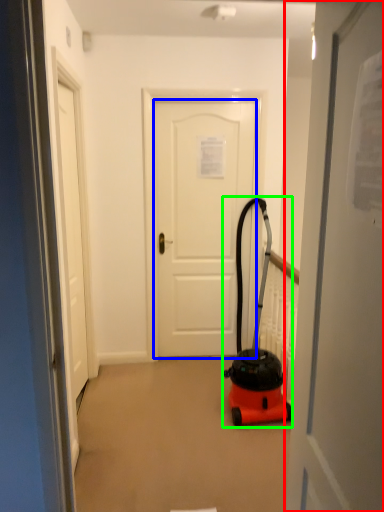
Question: Which is farther away from door (highlighted by a red box)? door (highlighted by a blue box) or equipment (highlighted by a green box)?

Choices:
 (A) door
 (B) equipment

Answer: (A)